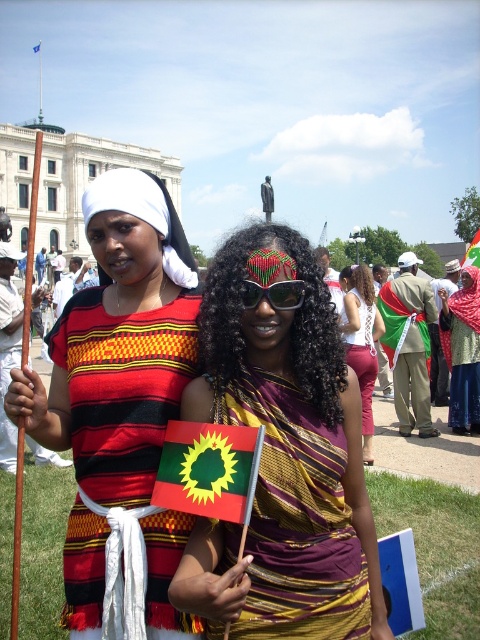
In the scene shown: You are a photographer at the event and want to capture a clear photo of the matte black dress at center without the black plastic sunglasses at center blocking it. Is this possible based on their positions?

The matte black dress at center is in front of the black plastic sunglasses at center, so the dress will block the sunglasses in the photo.

You are a photographer at the event and need to capture a photo where both the matte fabric dress at center and the white fabric headdress at upper left are clearly visible. Given their sizes, which object should you focus on to ensure both are in frame?

The matte fabric dress at center is taller than the white fabric headdress at upper left. To ensure both are in frame, focus on the matte fabric dress at center as it is larger and will help position the headdress within the shot.